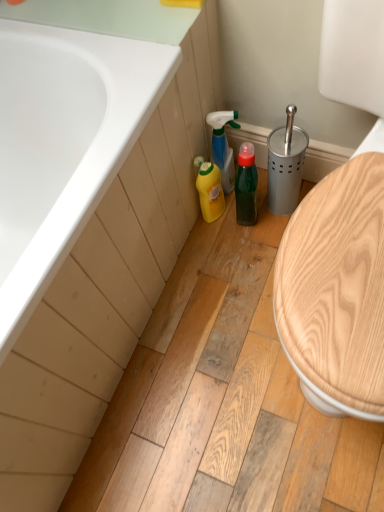
The width and height of the screenshot is (384, 512). Find the location of `free space on the front side of translucent green spray bottle at center, the first cleaning product positioned from the top`. free space on the front side of translucent green spray bottle at center, the first cleaning product positioned from the top is located at coordinates (238, 233).